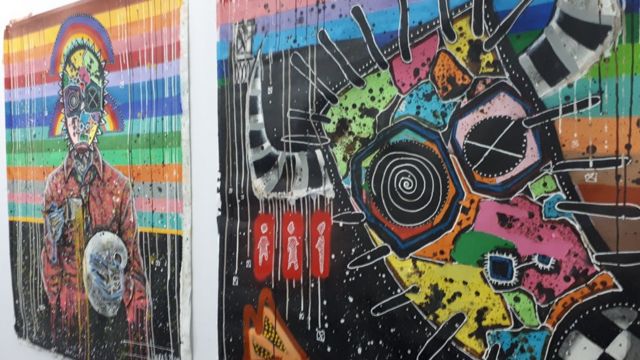
At what (x,y) coordinates should I click in order to perform the action: click on chest. Please return your answer as a coordinate pair (x, y). This screenshot has height=360, width=640. Looking at the image, I should click on (67, 195), (109, 194).